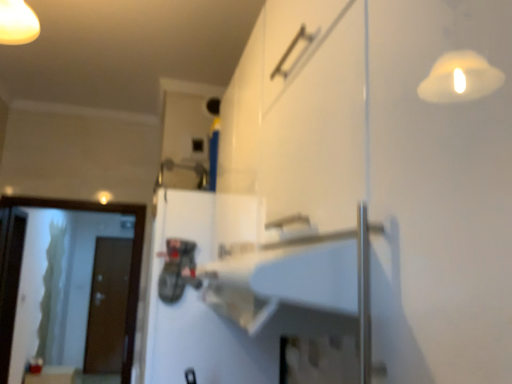
Question: Is the depth of brown matte door at left, the second door when ordered from top to bottom, greater than that of white glossy screen door at left, placed as the second screen door when sorted from back to front?

Choices:
 (A) yes
 (B) no

Answer: (A)

Question: Considering the relative sizes of brown matte door at left, the second door positioned from the front, and white glossy screen door at left, the 2th screen door in the left-to-right sequence, in the image provided, is brown matte door at left, the second door positioned from the front, taller than white glossy screen door at left, the 2th screen door in the left-to-right sequence,?

Choices:
 (A) no
 (B) yes

Answer: (B)

Question: From the image's perspective, is brown matte door at left, which ranks as the first door in left-to-right order, on top of white glossy screen door at left, the 2th screen door in the left-to-right sequence?

Choices:
 (A) no
 (B) yes

Answer: (A)

Question: Does brown matte door at left, which ranks as the first door in back-to-front order, have a larger size compared to white glossy screen door at left, which appears as the 1th screen door when viewed from the right?

Choices:
 (A) no
 (B) yes

Answer: (B)

Question: Considering the relative positions of brown matte door at left, which is counted as the second door, starting from the right, and white glossy screen door at left, which appears as the 1th screen door when viewed from the right, in the image provided, is brown matte door at left, which is counted as the second door, starting from the right, to the right of white glossy screen door at left, which appears as the 1th screen door when viewed from the right, from the viewer's perspective?

Choices:
 (A) no
 (B) yes

Answer: (A)

Question: Relative to transparent glass screen door at left, which is counted as the first screen door, starting from the left, is white matte door at center, which ranks as the 2th door in back-to-front order, in front or behind?

Choices:
 (A) behind
 (B) front

Answer: (B)

Question: From the image's perspective, is white matte door at center, which is the 1th door from right to left, above or below transparent glass screen door at left, acting as the 2th screen door starting from the front?

Choices:
 (A) below
 (B) above

Answer: (B)

Question: From a real-world perspective, is white matte door at center, which is the 1th door from right to left, above or below transparent glass screen door at left, the 1th screen door positioned from the back?

Choices:
 (A) below
 (B) above

Answer: (B)

Question: Is point (158, 312) positioned closer to the camera than point (4, 382)?

Choices:
 (A) farther
 (B) closer

Answer: (B)

Question: From the image's perspective, is white matte door at center, which ranks as the second door in bottom-to-top order, above or below brown matte door at left, the second door when ordered from top to bottom?

Choices:
 (A) below
 (B) above

Answer: (B)

Question: Is white matte door at center, which ranks as the second door in bottom-to-top order, bigger or smaller than brown matte door at left, the second door positioned from the front?

Choices:
 (A) big
 (B) small

Answer: (A)

Question: From their relative heights in the image, would you say white matte door at center, which ranks as the second door in bottom-to-top order, is taller or shorter than brown matte door at left, which is counted as the second door, starting from the right?

Choices:
 (A) tall
 (B) short

Answer: (B)

Question: In terms of width, does white matte door at center, which ranks as the second door in bottom-to-top order, look wider or thinner when compared to brown matte door at left, which ranks as the first door in left-to-right order?

Choices:
 (A) wide
 (B) thin

Answer: (A)

Question: Considering the positions of white glossy screen door at left, placed as the second screen door when sorted from back to front, and white matte door at center, the 2th door from the left, in the image, is white glossy screen door at left, placed as the second screen door when sorted from back to front, wider or thinner than white matte door at center, the 2th door from the left,?

Choices:
 (A) thin
 (B) wide

Answer: (A)

Question: Is white glossy screen door at left, the first screen door in the front-to-back sequence, taller or shorter than white matte door at center, the 2th door from the left?

Choices:
 (A) short
 (B) tall

Answer: (B)